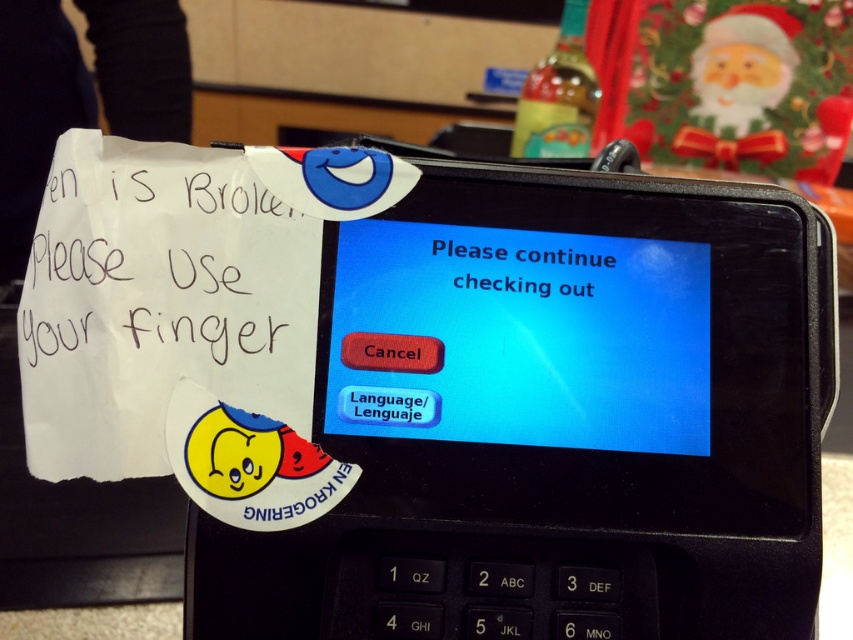
You are a customer at Kroger and need to input a code using the numeric keypad below the screen. The keypad has keys labeled 1 through 6. The black plastic phone at center and blue glossy text at center are in your line of sight. Can you comfortably reach both the keypad and these two items while keeping your hand on the keypad?

The distance between the black plastic phone at center and blue glossy text at center is 6.08 inches. Since the keypad is below the screen and the items are at center, your hand would need to stretch about 6.08 inches between them while maintaining contact with the keypad. This may be possible for some users depending on hand size, but there is a notable distance to cover.

Consider the image. You are at a Kroger checkout terminal and see the black plastic phone at center and the blue glossy text at center. Which object is wider?

The black plastic phone at center is wider than the blue glossy text at center.